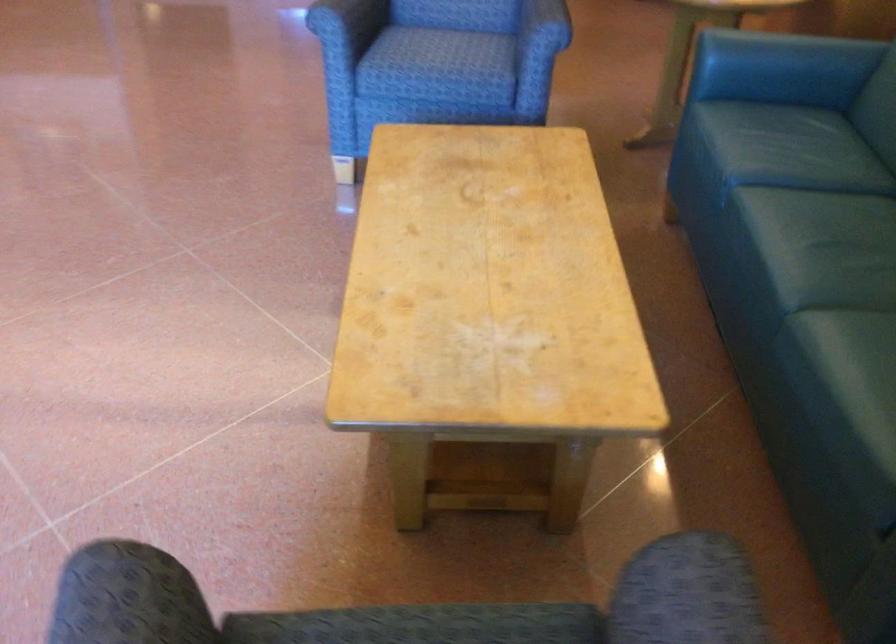
Find where to sit the blue chair sitting surface. Please return your answer as a coordinate pair (x, y).

(442, 55)